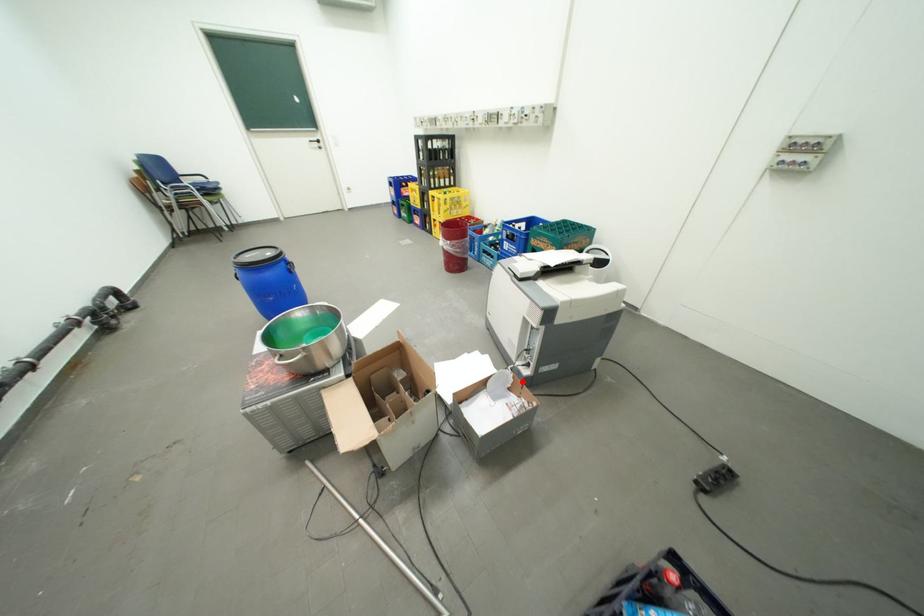
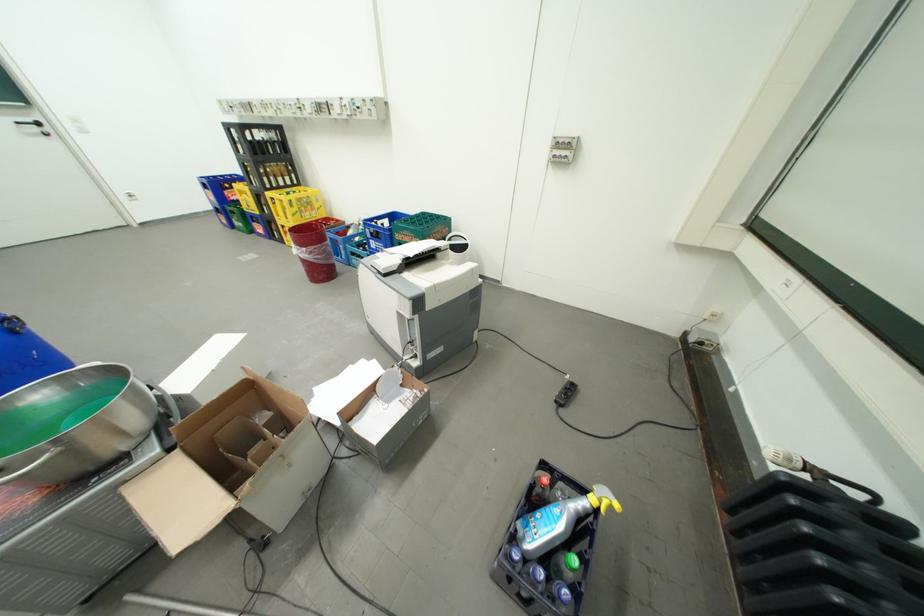
The point at the highlighted location is marked in the first image. Where is the corresponding point in the second image?

(411, 377)